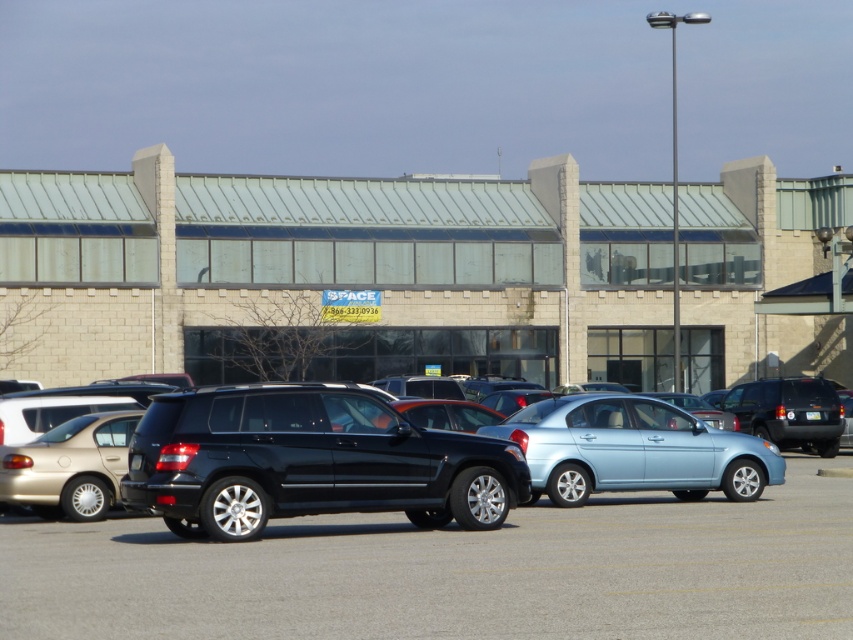
Question: Among these points, which one is nearest to the camera?

Choices:
 (A) (448, 480)
 (B) (219, 497)

Answer: (B)

Question: Is glossy black suv at center above light blue metallic sedan at center?

Choices:
 (A) yes
 (B) no

Answer: (A)

Question: Does shiny black suv at center appear under light blue metallic sedan at center?

Choices:
 (A) no
 (B) yes

Answer: (B)

Question: Which of the following is the farthest from the observer?

Choices:
 (A) glossy black suv at center
 (B) shiny black suv at center
 (C) light blue metallic sedan at center

Answer: (C)

Question: Is glossy black suv at center smaller than light blue metallic sedan at center?

Choices:
 (A) no
 (B) yes

Answer: (B)

Question: Estimate the real-world distances between objects in this image. Which object is closer to the shiny black suv at center?

Choices:
 (A) light blue metallic sedan at center
 (B) glossy black suv at center

Answer: (B)